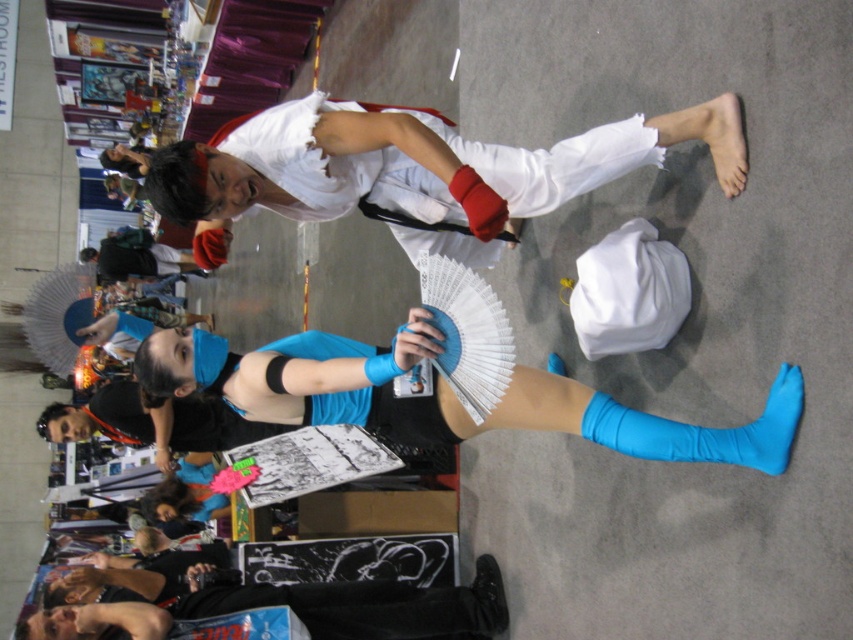
Question: Which point is farther from the camera taking this photo?

Choices:
 (A) (494, 579)
 (B) (720, 456)

Answer: (A)

Question: Is black leather jacket at lower left bigger than blue stretchy sock at lower right?

Choices:
 (A) yes
 (B) no

Answer: (A)

Question: Can you confirm if black leather jacket at lower left is positioned to the right of blue stretchy sock at lower right?

Choices:
 (A) no
 (B) yes

Answer: (A)

Question: Can you confirm if black leather jacket at lower left is positioned above blue stretchy sock at lower right?

Choices:
 (A) yes
 (B) no

Answer: (B)